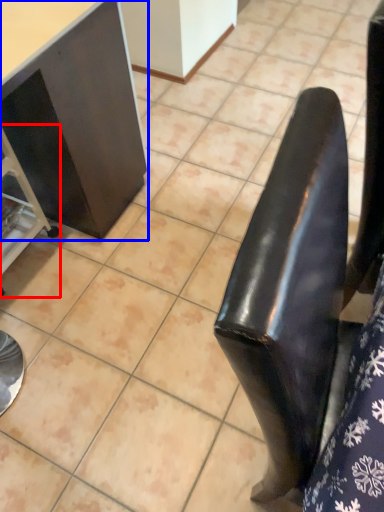
Question: Which object is closer to the camera taking this photo, furniture (highlighted by a red box) or furniture (highlighted by a blue box)?

Choices:
 (A) furniture
 (B) furniture

Answer: (B)